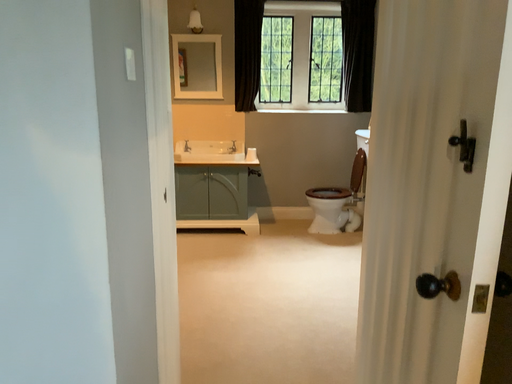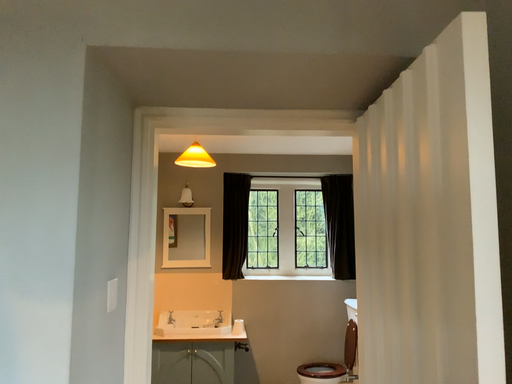
Question: How did the camera likely rotate when shooting the video?

Choices:
 (A) rotated upward
 (B) rotated downward

Answer: (A)